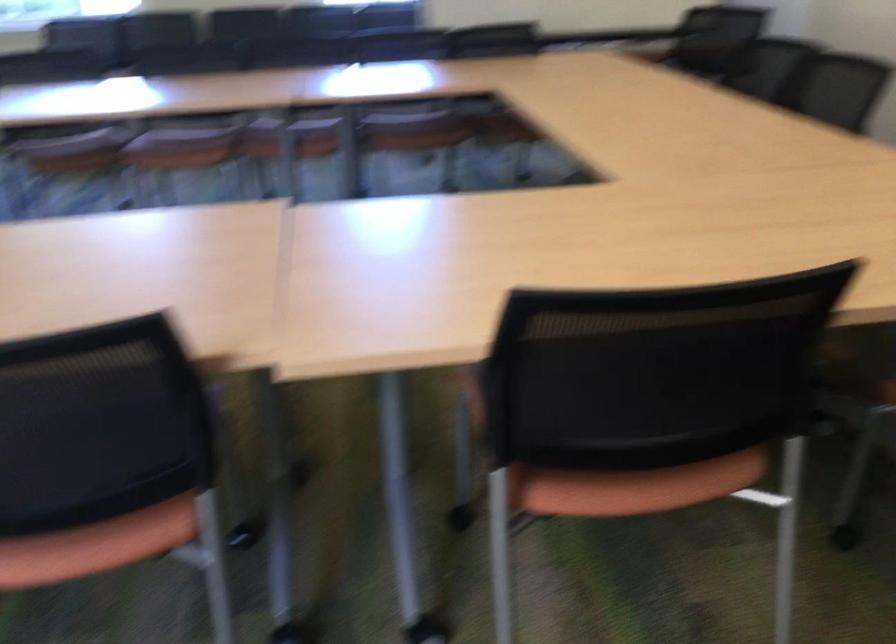
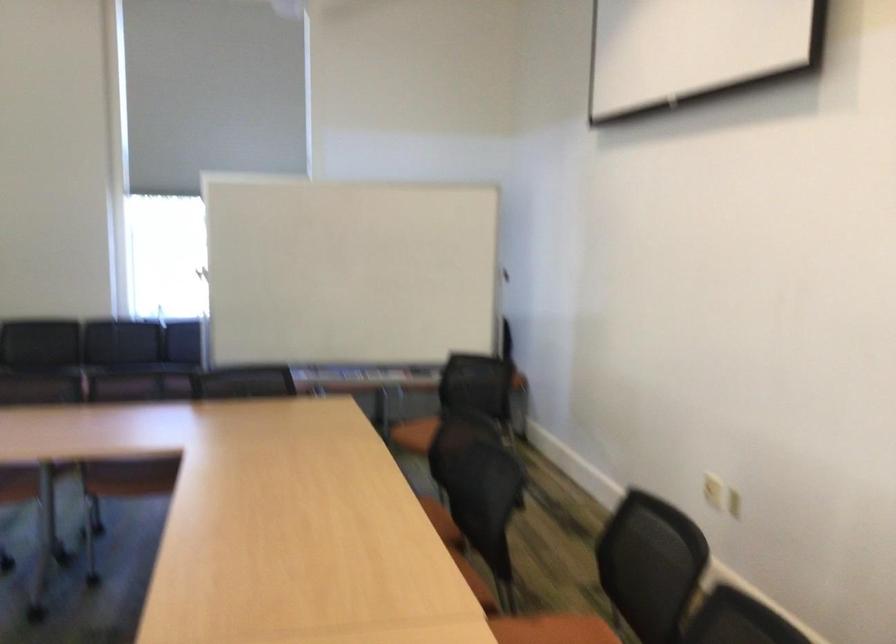
Question: How did the camera likely rotate?

Choices:
 (A) Left
 (B) Right
 (C) Up
 (D) Down

Answer: (C)